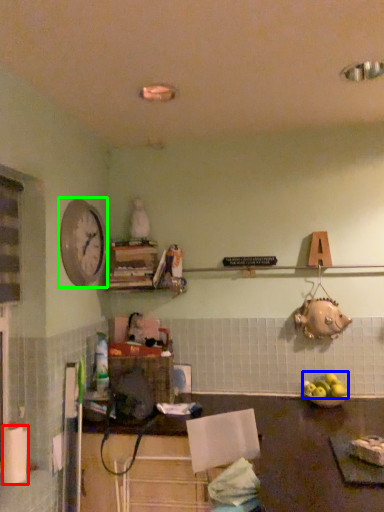
Question: Which is farther away from paper towel (highlighted by a red box)? apple (highlighted by a blue box) or clock (highlighted by a green box)?

Choices:
 (A) apple
 (B) clock

Answer: (A)